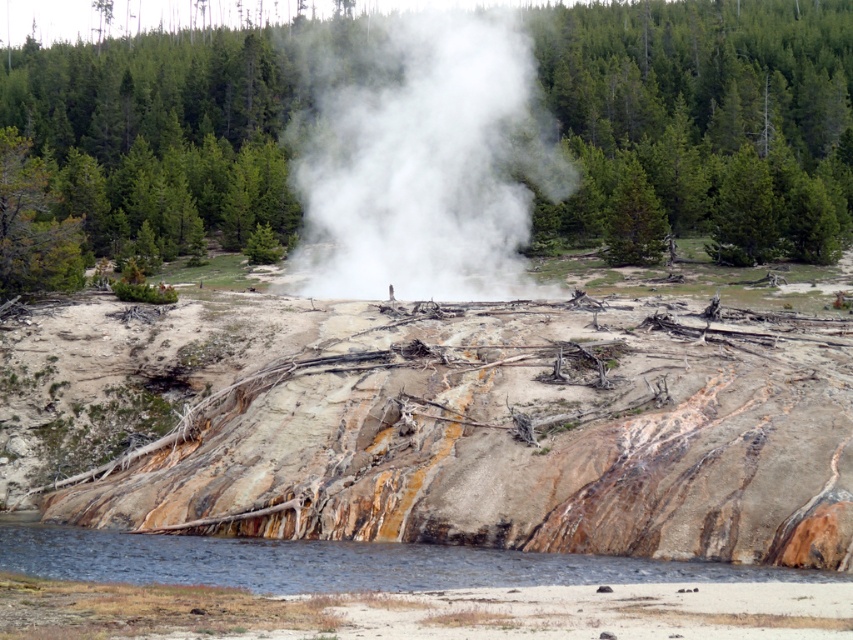
You are a park ranger observing the geothermal area. You notice the green leafy tree at center and the white vapor at center. Which object is located higher in the scene?

The green leafy tree at center is positioned over the white vapor at center, so it is higher in the scene.

You are a hiker standing at the edge of the clear water at lower left and want to reach the green leafy tree at center. Which direction should you walk to get there?

The green leafy tree at center is positioned on the left side of clear water at lower left, so you should walk to the right to reach it.

You are standing at the edge of the geothermal area and see the point marked at coordinates point [426,168]. What is located at that point?

The point at [426,168] corresponds to white vapor at center.